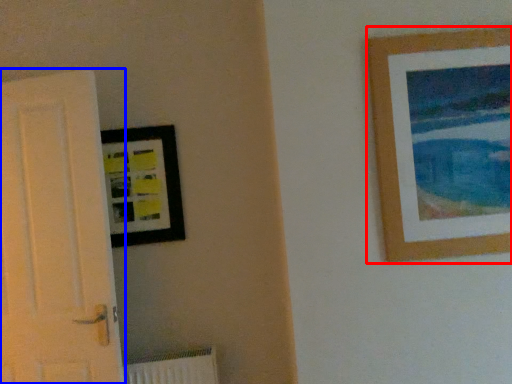
Question: Which point is closer to the camera, picture frame (highlighted by a red box) or door (highlighted by a blue box)?

Choices:
 (A) picture frame
 (B) door

Answer: (A)